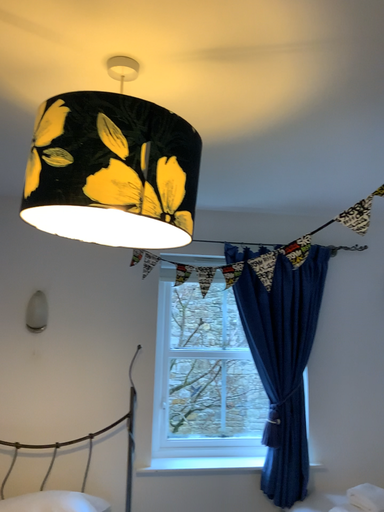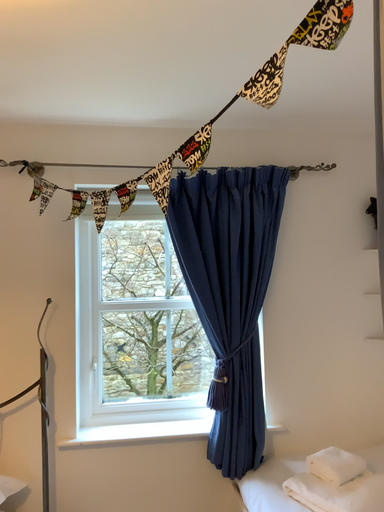
Question: Which way did the camera rotate in the video?

Choices:
 (A) rotated downward
 (B) rotated upward

Answer: (A)